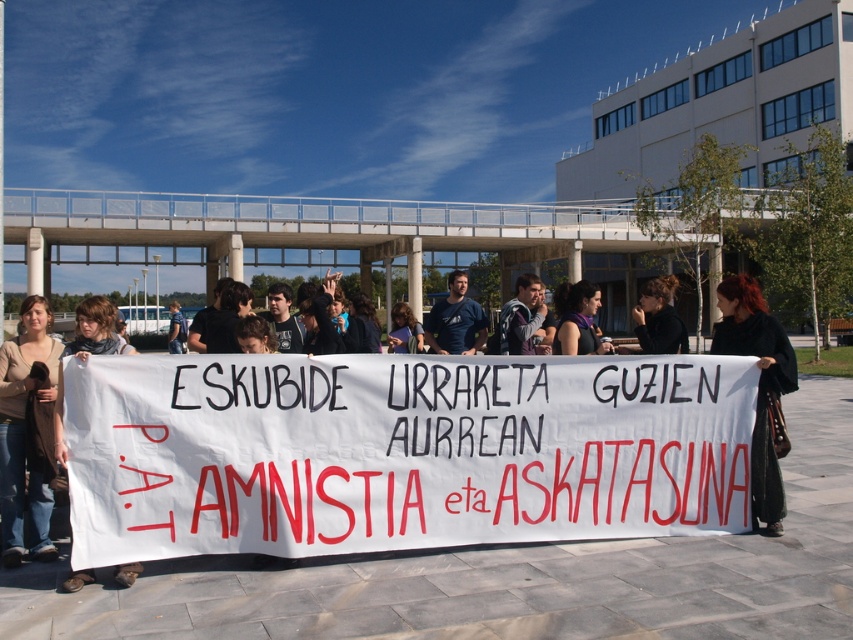
Which is more to the left, dark brown leather jacket at lower right or gray sweater at center?

gray sweater at center is more to the left.

Which is below, dark brown leather jacket at lower right or gray sweater at center?

dark brown leather jacket at lower right

Is point (772, 346) in front of point (518, 308)?

Yes.

At what (x,y) coordinates should I click in order to perform the action: click on dark brown leather jacket at lower right. Please return your answer as a coordinate pair (x, y). Image resolution: width=853 pixels, height=640 pixels. Looking at the image, I should click on coord(758,384).

Can you confirm if matte black scarf at lower left is positioned to the left of dark blue t-shirt at center?

Correct, you'll find matte black scarf at lower left to the left of dark blue t-shirt at center.

Is point (56, 445) more distant than point (450, 323)?

No, it is not.

This screenshot has height=640, width=853. I want to click on matte black scarf at lower left, so click(x=86, y=352).

This screenshot has height=640, width=853. In order to click on matte black scarf at lower left in this screenshot , I will do `click(86, 352)`.

Does point (44, 323) come closer to viewer compared to point (61, 356)?

Yes, it is in front of point (61, 356).

How much distance is there between brown sweater at lower left and matte black scarf at lower left?

brown sweater at lower left and matte black scarf at lower left are 21.15 inches apart.

Is point (22, 401) closer to viewer compared to point (97, 346)?

No, (22, 401) is behind (97, 346).

Locate an element on the screen. This screenshot has height=640, width=853. brown sweater at lower left is located at coordinates (21, 413).